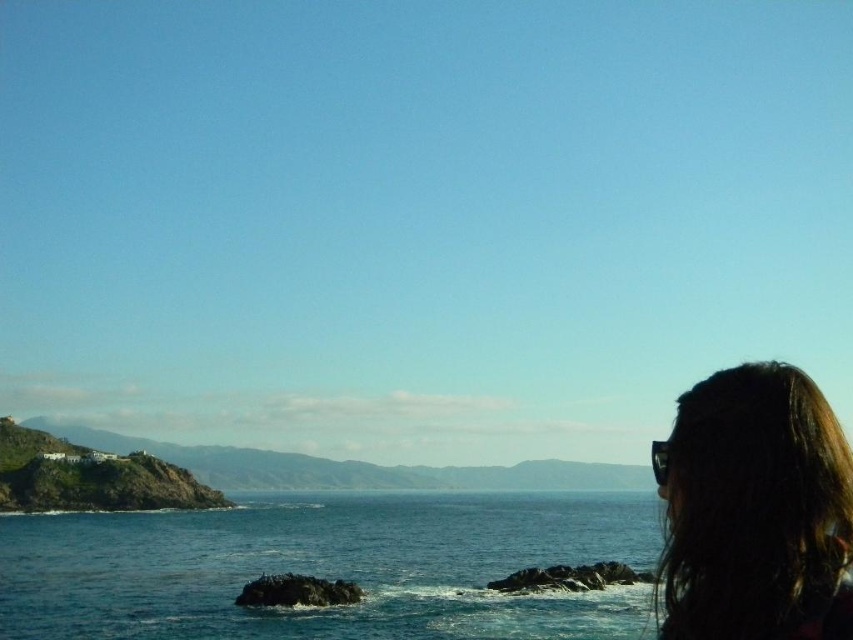
Does blue water at center have a lesser width compared to dark hair at upper right?

In fact, blue water at center might be wider than dark hair at upper right.

Image resolution: width=853 pixels, height=640 pixels. Describe the element at coordinates (328, 566) in the screenshot. I see `blue water at center` at that location.

Image resolution: width=853 pixels, height=640 pixels. I want to click on blue water at center, so tap(328, 566).